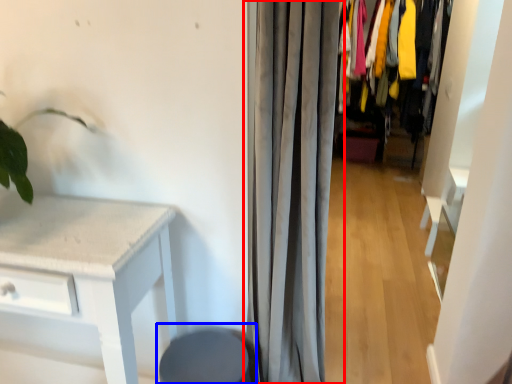
Question: Among these objects, which one is nearest to the camera, curtain (highlighted by a red box) or swivel chair (highlighted by a blue box)?

Choices:
 (A) curtain
 (B) swivel chair

Answer: (A)